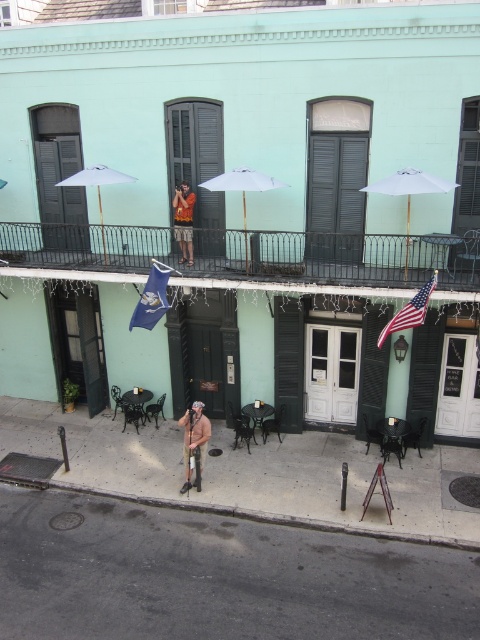
You are a delivery person trying to avoid stepping on the green matte shutter at upper center while walking on the smooth concrete sidewalk at lower center. Is this possible?

The smooth concrete sidewalk at lower center is below the green matte shutter at upper center, so you can walk on the sidewalk without stepping on the shutter since they are at different heights.

You are a delivery person approaching the building and need to park your vehicle on the gray asphalt at lower left. However, there is a smooth concrete sidewalk at lower center nearby. Which surface should you avoid driving over to prevent damaging the sidewalk? Please specify both surfaces mentioned.

You should avoid driving over the smooth concrete sidewalk at lower center because it is more delicate and designed for pedestrians. The gray asphalt at lower left is suitable for vehicle parking as it is meant for that purpose.

You are a delivery person trying to place a package on the smooth concrete sidewalk at lower center. However, you notice the green matte shutter at upper center is in the way. Can you place the package there without it being blocked by the shutter?

The smooth concrete sidewalk at lower center has a lesser height compared to the green matte shutter at upper center. Since the shutter is higher up, it won not block the sidewalk area where you want to place the package. You can safely put the package there.